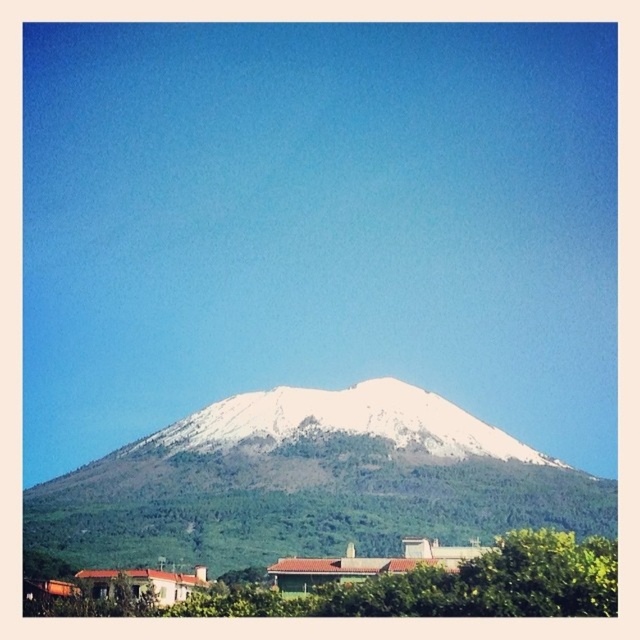
Between snowy rock mountain at center and white snow-covered mountain at center, which one appears on the left side from the viewer's perspective?

snowy rock mountain at center is more to the left.

Which of these two, snowy rock mountain at center or white snow-covered mountain at center, stands taller?

snowy rock mountain at center is taller.

Where is `snowy rock mountain at center`? The image size is (640, 640). snowy rock mountain at center is located at coordinates (308, 483).